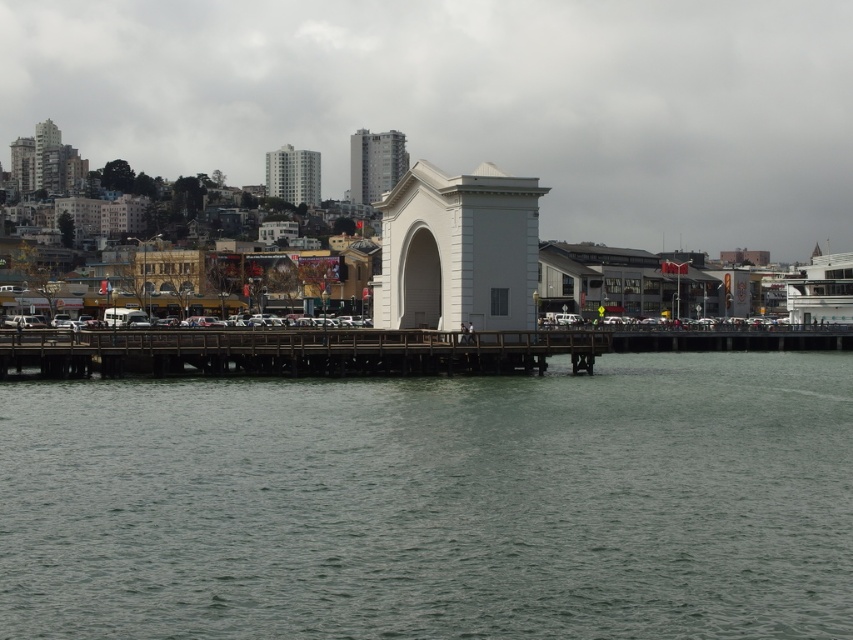
Does green water at lower center have a smaller size compared to wooden bridge at center?

Actually, green water at lower center might be larger than wooden bridge at center.

Which of these two, green water at lower center or wooden bridge at center, stands shorter?

green water at lower center is shorter.

The image size is (853, 640). Identify the location of green water at lower center. (434, 502).